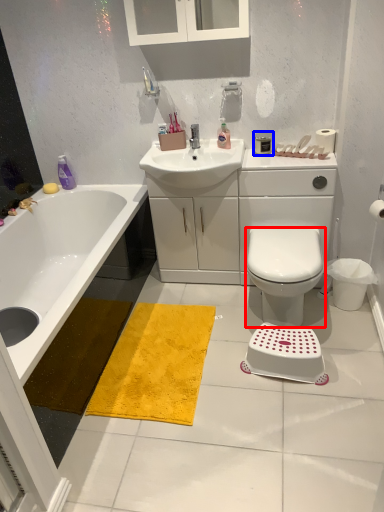
Question: Among these objects, which one is nearest to the camera, bidet (highlighted by a red box) or toiletry (highlighted by a blue box)?

Choices:
 (A) bidet
 (B) toiletry

Answer: (A)